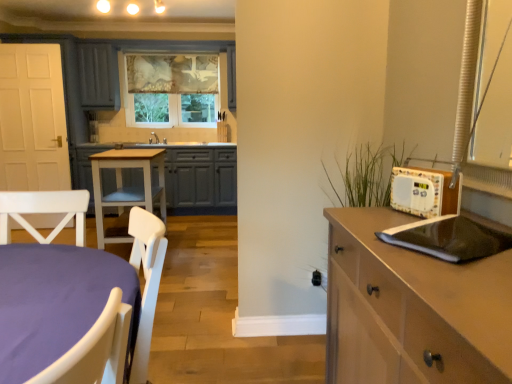
Where is `vacant area that is in front of black matte laptop at right`? The width and height of the screenshot is (512, 384). vacant area that is in front of black matte laptop at right is located at coordinates (457, 280).